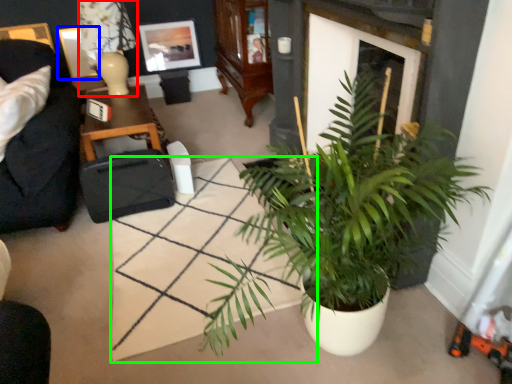
Question: Considering the real-world distances, which object is closest to lamp (highlighted by a red box)? picture frame (highlighted by a blue box) or square (highlighted by a green box).

Choices:
 (A) picture frame
 (B) square

Answer: (A)